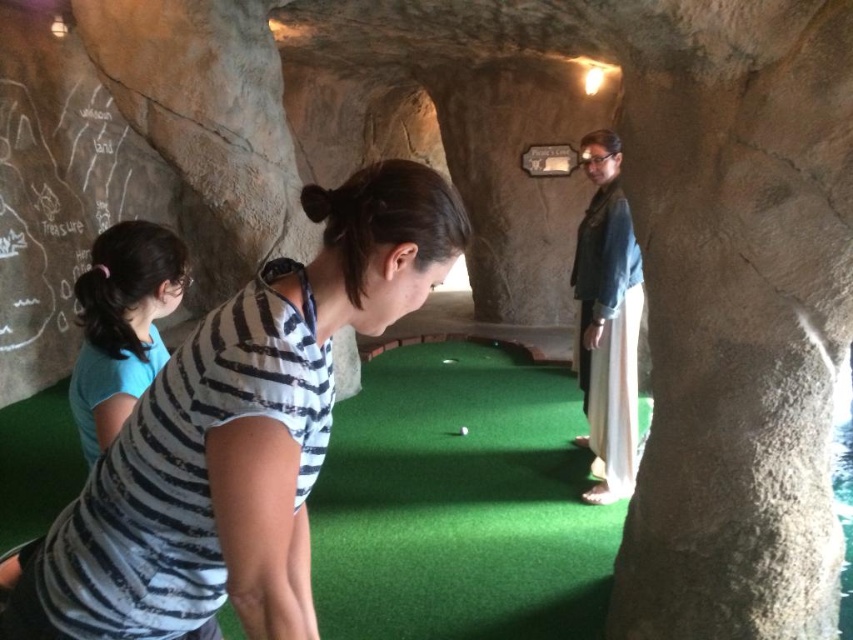
Does point (599, 324) come closer to viewer compared to point (83, 344)?

No, (599, 324) is behind (83, 344).

Based on the photo, who is shorter, denim jacket at right or blue fabric shirt at left?

With less height is blue fabric shirt at left.

Locate an element on the screen. This screenshot has height=640, width=853. denim jacket at right is located at coordinates (607, 321).

You are a GUI agent. You are given a task and a screenshot of the screen. Output one action in this format:
    pyautogui.click(x=<x>, y=<y>)
    Task: Click on the denim jacket at right
    
    Given the screenshot: What is the action you would take?
    [607, 321]

Is striped fabric shirt at center in front of denim jacket at right?

Yes.

Who is taller, striped fabric shirt at center or denim jacket at right?

denim jacket at right

Locate an element on the screen. striped fabric shirt at center is located at coordinates (236, 435).

Is green artificial turf at center wider than blue fabric shirt at left?

Correct, the width of green artificial turf at center exceeds that of blue fabric shirt at left.

Is point (505, 493) positioned before point (178, 244)?

No, it is not.

Find the location of a particular element. The image size is (853, 640). green artificial turf at center is located at coordinates (459, 504).